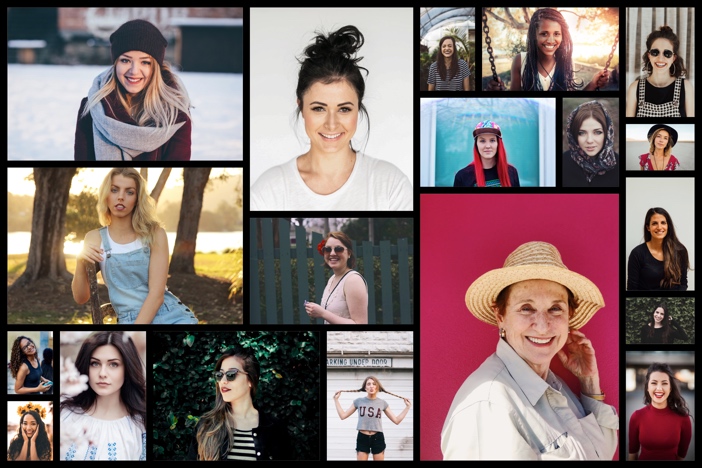
Where is `interior photos`? interior photos is located at coordinates (482, 234), (385, 124), (439, 125), (642, 16), (670, 189), (41, 343).